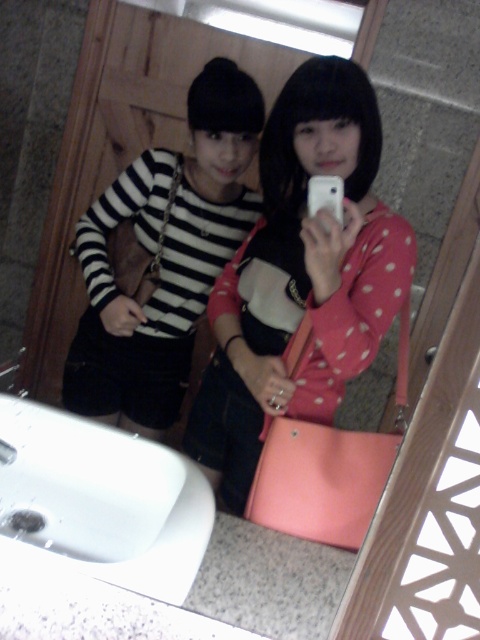
You are trying to locate the pink matte handbag at center in the image. Which of the following coordinates would you look at first? Choose between point A at (300, 276) and point B at 0.567, 0.345.

Point A at (300, 276) is on the pink matte handbag at center, so you should look there first.

You are trying to decide which item to grab quickly from the center of the image. Which one can you reach faster, the pink matte handbag at center or the striped fabric shirt at center?

The pink matte handbag at center is thinner than the striped fabric shirt at center, so it can be reached faster since it occupies less space.

You are trying to take a photo using the white matte smartphone at center in the mirror. However, you notice the white glossy sink at lower left is reflecting in the mirror and blocking part of the photo. Can you adjust your position so that the sink is no longer in the frame?

The white glossy sink at lower left is located below the white matte smartphone at center, so moving the smartphone upwards or tilting it slightly might help avoid the sink reflection in the mirror.